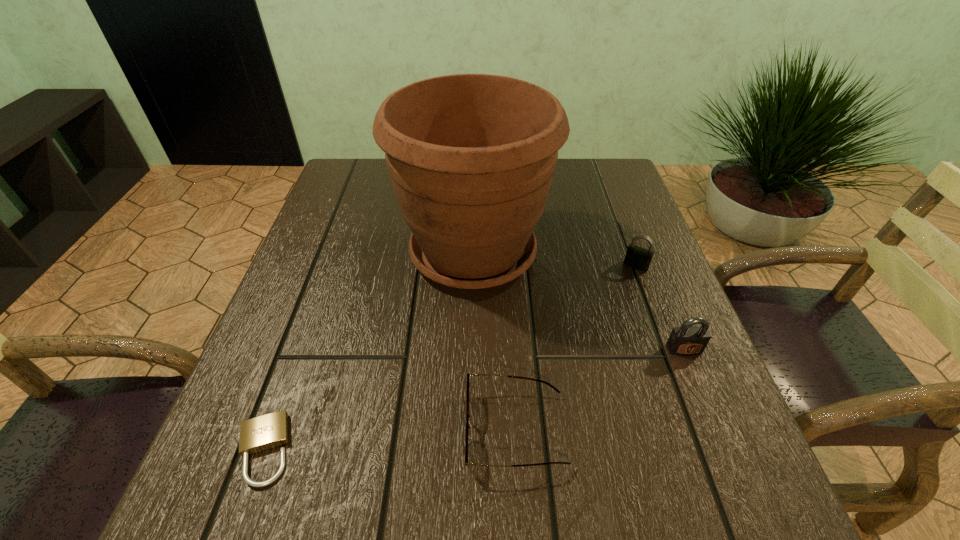
Where is `vacant area between the third nearest object and the shortest object`? This screenshot has width=960, height=540. vacant area between the third nearest object and the shortest object is located at coordinates (473, 400).

At what (x,y) coordinates should I click in order to perform the action: click on free space between the flowerpot and the shortest padlock. Please return your answer as a coordinate pair (x, y). This screenshot has width=960, height=540. Looking at the image, I should click on (368, 351).

The image size is (960, 540). In order to click on free space between the nearest padlock and the farthest padlock in this screenshot , I will do `click(449, 357)`.

Identify the location of vacant space that is in between the flowerpot and the farthest padlock. (555, 259).

You are a GUI agent. You are given a task and a screenshot of the screen. Output one action in this format:
    pyautogui.click(x=<x>, y=<y>)
    Task: Click on the object that is the closest one to the third farthest object
    The image size is (960, 540).
    Given the screenshot: What is the action you would take?
    pyautogui.click(x=636, y=257)

Find the location of a particular element. object identified as the second closest to the third farthest object is located at coordinates (471, 157).

Point out which padlock is positioned as the second nearest to the third nearest object. Please provide its 2D coordinates. Your answer should be formatted as a tuple, i.e. [(x, y)], where the tuple contains the x and y coordinates of a point satisfying the conditions above.

[(264, 432)]

Identify which padlock is the second closest to the farthest padlock. Please provide its 2D coordinates. Your answer should be formatted as a tuple, i.e. [(x, y)], where the tuple contains the x and y coordinates of a point satisfying the conditions above.

[(264, 432)]